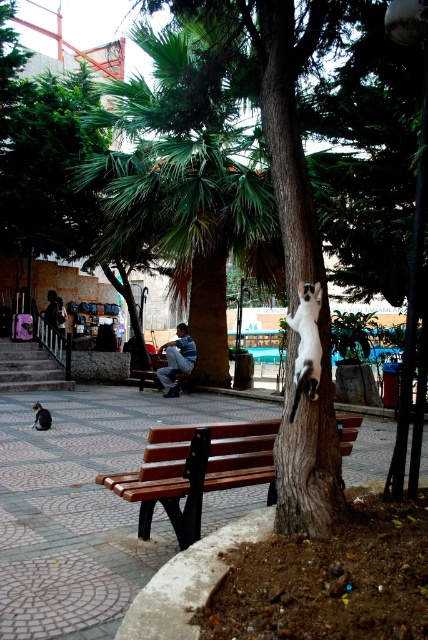
You are a visitor in the park and want to sit on the brown wood bench at center. To reach it, you need to walk from the white fur cat at upper center. Which direction should you walk relative to the cat?

The brown wood bench at center is to the right of the white fur cat at upper center, so you should walk to the right relative to the cat to reach the bench.

You are standing at the point labeled point (315, 369) and want to walk to the point labeled point (64, 330). Which direction should you move in to get closer to your destination?

You should move downward because point (64, 330) is located below point (315, 369).